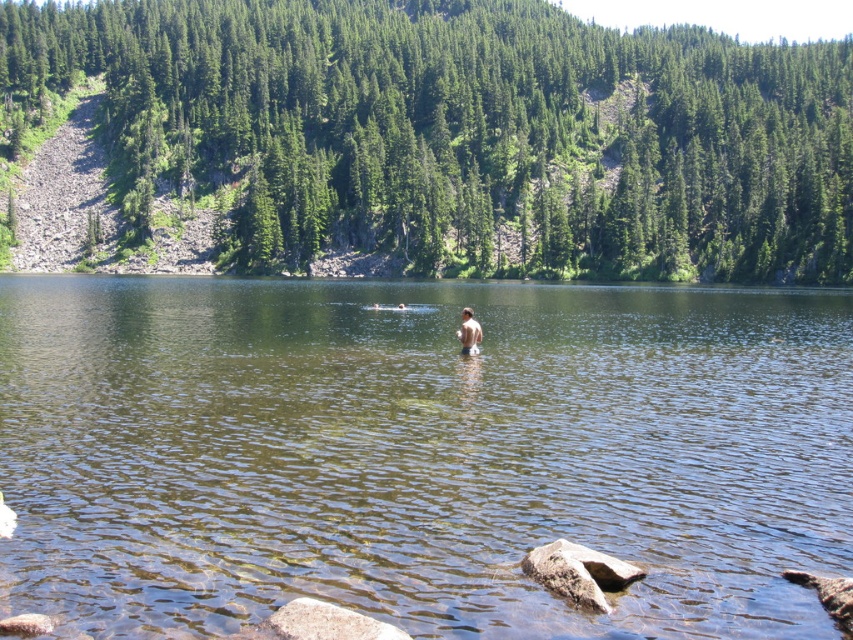
You are planning to cross the water area in the image using a small raft that can only handle surfaces narrower than the gray rough rock at lower center. Based on the scene, can you safely use the clear water at center for crossing?

The clear water at center is wider than the gray rough rock at lower center. Since your raft can only handle surfaces narrower than the gray rough rock at lower center, you cannot safely use the clear water at center for crossing.

You are standing at the edge of the lake and want to cross to the other side. You see clear water at center and gray rough rock at lower center. Which object is located above the other?

The clear water at center is positioned over the gray rough rock at lower center.